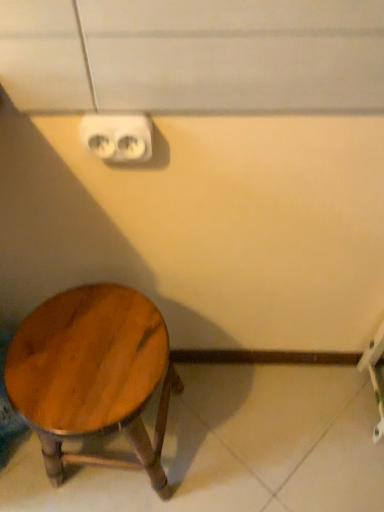
At what (x,y) coordinates should I click in order to perform the action: click on free location to the right of shiny brown wood stool at lower left. Please return your answer as a coordinate pair (x, y). The image size is (384, 512). Looking at the image, I should click on (219, 433).